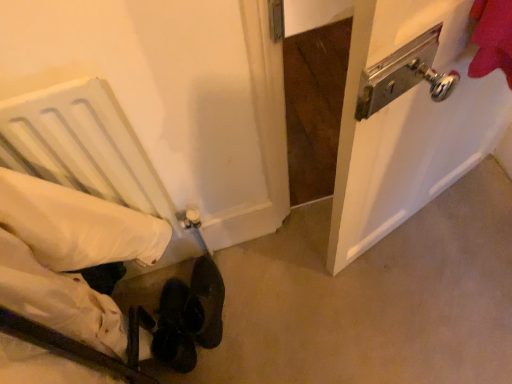
Question: From a real-world perspective, is white fabric bed at lower left physically located above or below metallic silver door handle at upper right?

Choices:
 (A) below
 (B) above

Answer: (B)

Question: Visually, is white fabric bed at lower left positioned to the left or to the right of metallic silver door handle at upper right?

Choices:
 (A) left
 (B) right

Answer: (A)

Question: Which is nearer to the leather at lower center?

Choices:
 (A) metallic silver door handle at upper right
 (B) white fabric bed at lower left

Answer: (B)

Question: Based on their relative distances, which object is nearer to the leather at lower center?

Choices:
 (A) white fabric bed at lower left
 (B) metallic silver door handle at upper right

Answer: (A)